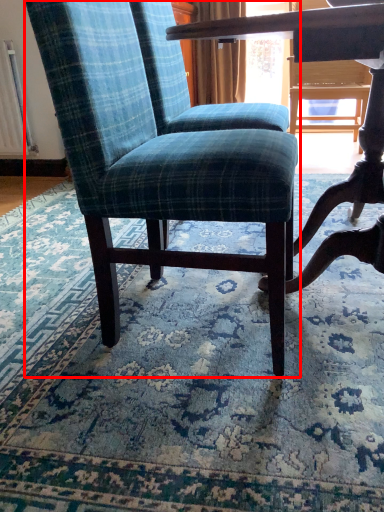
Question: From the image's perspective, considering the relative positions of chair (annotated by the red box) and mat in the image provided, where is chair (annotated by the red box) located with respect to the staircase?

Choices:
 (A) above
 (B) below

Answer: (A)